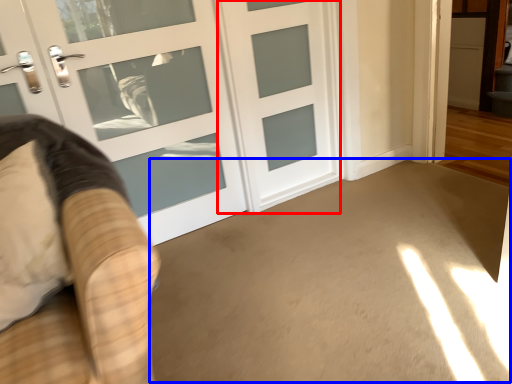
Question: Among these objects, which one is nearest to the camera, door (highlighted by a red box) or corridor (highlighted by a blue box)?

Choices:
 (A) door
 (B) corridor

Answer: (B)